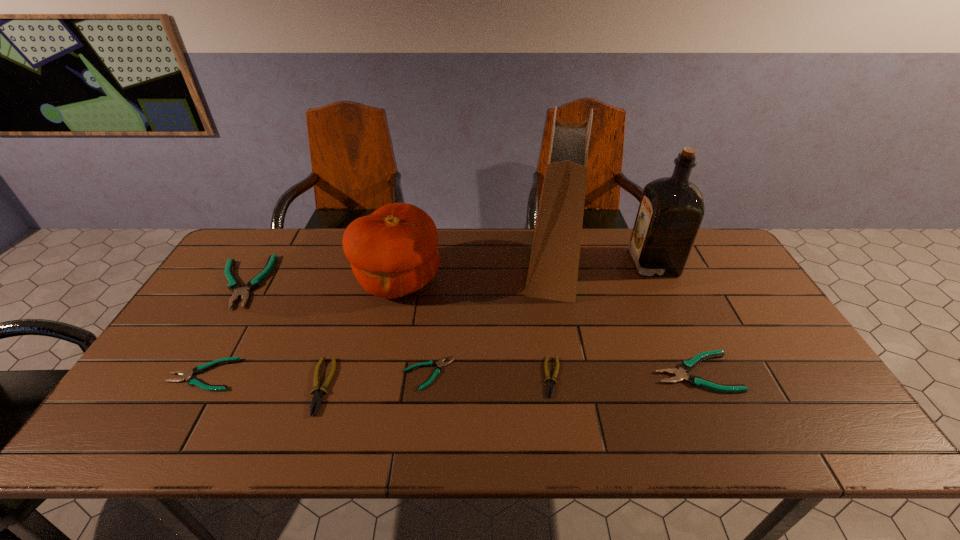
Identify the location of shopping bag. Image resolution: width=960 pixels, height=540 pixels. (553, 270).

The height and width of the screenshot is (540, 960). Identify the location of the eighth shortest object. (671, 210).

Identify the location of pumpkin. (393, 252).

The width and height of the screenshot is (960, 540). In order to click on the biggest teal pliers in this screenshot , I will do `click(234, 285)`.

Locate an element on the screen. the farthest pliers is located at coordinates (234, 285).

This screenshot has height=540, width=960. In order to click on the third smallest teal pliers in this screenshot , I will do `click(680, 374)`.

Where is `the rightmost teal pliers`? the rightmost teal pliers is located at coordinates (680, 374).

Locate an element on the screen. the left yellow pliers is located at coordinates (317, 397).

Image resolution: width=960 pixels, height=540 pixels. In order to click on the bigger yellow pliers in this screenshot , I will do point(317,397).

Identify the location of the second smallest teal pliers. This screenshot has height=540, width=960. (186, 375).